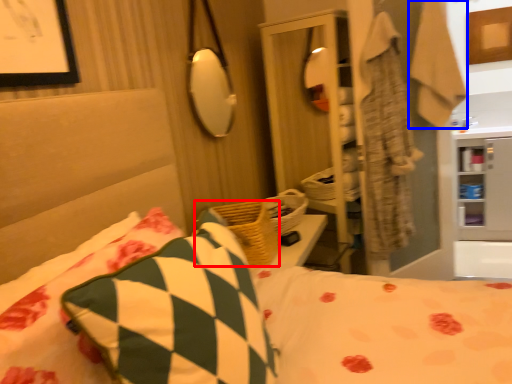
Question: Which of the following is the closest to the observer, basket (highlighted by a red box) or robe (highlighted by a blue box)?

Choices:
 (A) basket
 (B) robe

Answer: (A)